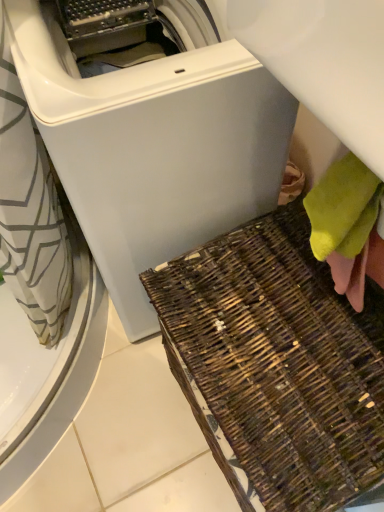
The width and height of the screenshot is (384, 512). Identify the location of blank space situated above brown woven basket at lower right (from a real-world perspective). (274, 350).